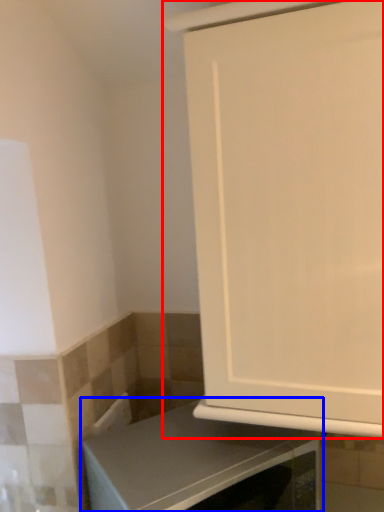
Question: Which of the following is the farthest to the observer, cabinetry (highlighted by a red box) or countertop (highlighted by a blue box)?

Choices:
 (A) cabinetry
 (B) countertop

Answer: (B)